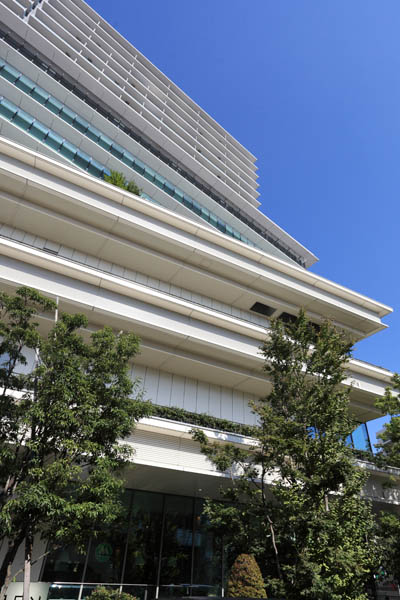
The height and width of the screenshot is (600, 400). Identify the location of vent. (263, 307), (286, 316), (315, 325).